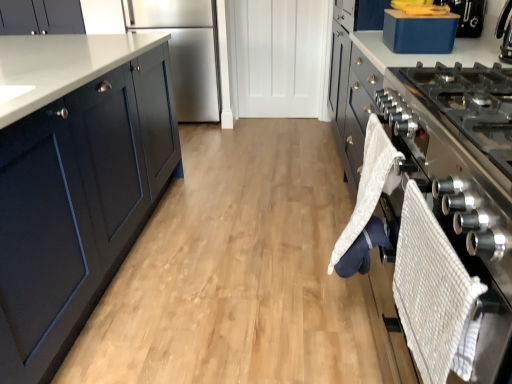
Describe the element at coordinates (419, 32) in the screenshot. I see `blue plastic container at upper right` at that location.

Where is `matte dark blue cabinet at upper left`? matte dark blue cabinet at upper left is located at coordinates (41, 17).

What is the approximate width of satin silver oven at right?

It is 18.90 inches.

Where is `satin silver oven at right`? satin silver oven at right is located at coordinates (464, 180).

Locate an element on the screen. This screenshot has height=384, width=512. stainless steel refrigerator at center is located at coordinates (186, 51).

Identify the location of blue plastic container at upper right. The image size is (512, 384). tap(419, 32).

From a real-world perspective, is blue plastic container at upper right positioned under stainless steel refrigerator at center based on gravity?

No.

Is blue plastic container at upper right positioned in front of stainless steel refrigerator at center?

Yes, blue plastic container at upper right is in front of stainless steel refrigerator at center.

Is blue plastic container at upper right at the right side of stainless steel refrigerator at center?

Indeed, blue plastic container at upper right is positioned on the right side of stainless steel refrigerator at center.

From the image's perspective, which object appears higher, stainless steel refrigerator at center or blue plastic container at upper right?

stainless steel refrigerator at center is shown above in the image.

Are stainless steel refrigerator at center and blue plastic container at upper right making contact?

No.

Looking at this image, between stainless steel refrigerator at center and blue plastic container at upper right, which one is positioned in front?

blue plastic container at upper right is closer to the camera.

Is blue plastic container at upper right completely or partially inside stainless steel refrigerator at center?

Actually, blue plastic container at upper right is outside stainless steel refrigerator at center.

Could you tell me if satin silver oven at right is turned towards blue plastic container at upper right?

No, satin silver oven at right is not oriented towards blue plastic container at upper right.

How many degrees apart are the facing directions of satin silver oven at right and blue plastic container at upper right?

satin silver oven at right and blue plastic container at upper right are facing 1.72 degrees away from each other.

From a real-world perspective, is satin silver oven at right physically located above or below blue plastic container at upper right?

satin silver oven at right is below blue plastic container at upper right.

In the image, there is a blue plastic container at upper right. Identify the location of oven below it (from the image's perspective). (464, 180).

Could you measure the distance between stainless steel refrigerator at center and matte dark blue cabinet at upper left?

The distance of stainless steel refrigerator at center from matte dark blue cabinet at upper left is 37.62 inches.

Which of these two, stainless steel refrigerator at center or matte dark blue cabinet at upper left, stands taller?

stainless steel refrigerator at center.

Is stainless steel refrigerator at center facing towards matte dark blue cabinet at upper left?

No, stainless steel refrigerator at center does not turn towards matte dark blue cabinet at upper left.

In terms of size, does stainless steel refrigerator at center appear bigger or smaller than matte dark blue cabinet at upper left?

In the image, stainless steel refrigerator at center appears to be larger than matte dark blue cabinet at upper left.

Which of these two, matte dark blue cabinet at upper left or satin silver oven at right, is smaller?

A: matte dark blue cabinet at upper left is smaller.

Is matte dark blue cabinet at upper left further to camera compared to satin silver oven at right?

Yes, matte dark blue cabinet at upper left is further from the camera.

Is matte dark blue cabinet at upper left taller than satin silver oven at right?

Indeed, matte dark blue cabinet at upper left has a greater height compared to satin silver oven at right.

From a real-world perspective, is matte dark blue cabinet at upper left above or below satin silver oven at right?

matte dark blue cabinet at upper left is situated higher than satin silver oven at right in the real world.

From a real-world perspective, which is physically above, satin silver oven at right or stainless steel refrigerator at center?

In real-world perspective, satin silver oven at right is above.

From the picture: Is satin silver oven at right surrounding stainless steel refrigerator at center?

That's incorrect, stainless steel refrigerator at center is not inside satin silver oven at right.

Is stainless steel refrigerator at center at the back of satin silver oven at right?

satin silver oven at right is not turned away from stainless steel refrigerator at center.

Is the surface of matte dark blue cabinet at upper left in direct contact with stainless steel refrigerator at center?

matte dark blue cabinet at upper left and stainless steel refrigerator at center are not in contact.

From the image's perspective, is matte dark blue cabinet at upper left on stainless steel refrigerator at center?

Indeed, from the image's perspective, matte dark blue cabinet at upper left is shown above stainless steel refrigerator at center.

Can you confirm if matte dark blue cabinet at upper left is positioned to the right of stainless steel refrigerator at center?

No, matte dark blue cabinet at upper left is not to the right of stainless steel refrigerator at center.

From a real-world perspective, which is physically above, matte dark blue cabinet at upper left or stainless steel refrigerator at center?

In real-world perspective, matte dark blue cabinet at upper left is above.

At what (x,y) coordinates should I click in order to perform the action: click on kitchen appliance in front of the stainless steel refrigerator at center. Please return your answer as a coordinate pair (x, y). The image size is (512, 384). Looking at the image, I should click on (419, 32).

At what (x,y) coordinates should I click in order to perform the action: click on kitchen appliance located above the stainless steel refrigerator at center (from a real-world perspective). Please return your answer as a coordinate pair (x, y). This screenshot has width=512, height=384. Looking at the image, I should click on (419, 32).

Considering their positions, is stainless steel refrigerator at center positioned further to satin silver oven at right than blue plastic container at upper right?

stainless steel refrigerator at center is further to satin silver oven at right.

Looking at the image, which one is located closer to stainless steel refrigerator at center, blue plastic container at upper right or matte dark blue cabinet at upper left?

Based on the image, matte dark blue cabinet at upper left appears to be nearer to stainless steel refrigerator at center.

When comparing their distances from matte dark blue cabinet at upper left, does stainless steel refrigerator at center or blue plastic container at upper right seem closer?

stainless steel refrigerator at center is positioned closer to the anchor matte dark blue cabinet at upper left.

From the image, which object appears to be nearer to blue plastic container at upper right, satin silver oven at right or matte dark blue cabinet at upper left?

satin silver oven at right.

Based on the photo, based on their spatial positions, is satin silver oven at right or blue plastic container at upper right closer to stainless steel refrigerator at center?

blue plastic container at upper right is closer to stainless steel refrigerator at center.

From the image, which object appears to be nearer to stainless steel refrigerator at center, blue plastic container at upper right or satin silver oven at right?

blue plastic container at upper right lies closer to stainless steel refrigerator at center than the other object.

From the image, which object appears to be farther from satin silver oven at right, blue plastic container at upper right or stainless steel refrigerator at center?

stainless steel refrigerator at center lies further to satin silver oven at right than the other object.

Based on their spatial positions, is blue plastic container at upper right or matte dark blue cabinet at upper left closer to satin silver oven at right?

blue plastic container at upper right lies closer to satin silver oven at right than the other object.

Locate an element on the screen. The width and height of the screenshot is (512, 384). refrigerator situated between matte dark blue cabinet at upper left and blue plastic container at upper right from left to right is located at coordinates point(186,51).

Where is `refrigerator between satin silver oven at right and matte dark blue cabinet at upper left in the front-back direction`? This screenshot has height=384, width=512. refrigerator between satin silver oven at right and matte dark blue cabinet at upper left in the front-back direction is located at coordinates (186, 51).

At what (x,y) coordinates should I click in order to perform the action: click on kitchen appliance between satin silver oven at right and matte dark blue cabinet at upper left in the front-back direction. Please return your answer as a coordinate pair (x, y). This screenshot has width=512, height=384. Looking at the image, I should click on (419, 32).

This screenshot has height=384, width=512. Find the location of `kitchen appliance positioned between satin silver oven at right and stainless steel refrigerator at center from near to far`. kitchen appliance positioned between satin silver oven at right and stainless steel refrigerator at center from near to far is located at coordinates (419, 32).